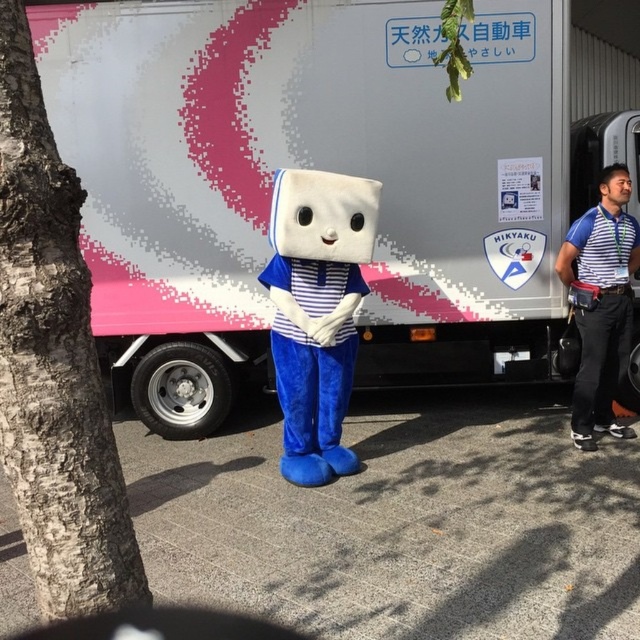
Can you confirm if white plush mascot at center is bigger than blue striped shirt at right?

Indeed, white plush mascot at center has a larger size compared to blue striped shirt at right.

Does white plush mascot at center have a greater width compared to blue striped shirt at right?

Correct, the width of white plush mascot at center exceeds that of blue striped shirt at right.

What do you see at coordinates (316, 310) in the screenshot? The width and height of the screenshot is (640, 640). I see `white plush mascot at center` at bounding box center [316, 310].

At what (x,y) coordinates should I click in order to perform the action: click on white plush mascot at center. Please return your answer as a coordinate pair (x, y). Looking at the image, I should click on (316, 310).

How far apart are white matte truck at center and white plush mascot at center?

They are 3.33 feet apart.

Is white matte truck at center positioned at the back of white plush mascot at center?

Yes.

Is point (230, 136) positioned behind point (296, 252)?

Yes.

Locate an element on the screen. This screenshot has height=640, width=640. white matte truck at center is located at coordinates pos(321,168).

Who is lower down, white matte truck at center or blue striped shirt at right?

blue striped shirt at right is below.

You are a GUI agent. You are given a task and a screenshot of the screen. Output one action in this format:
    pyautogui.click(x=<x>, y=<y>)
    Task: Click on the white matte truck at center
    The height and width of the screenshot is (640, 640).
    Given the screenshot: What is the action you would take?
    pyautogui.click(x=321, y=168)

Identify the location of white matte truck at center. This screenshot has height=640, width=640. (321, 168).